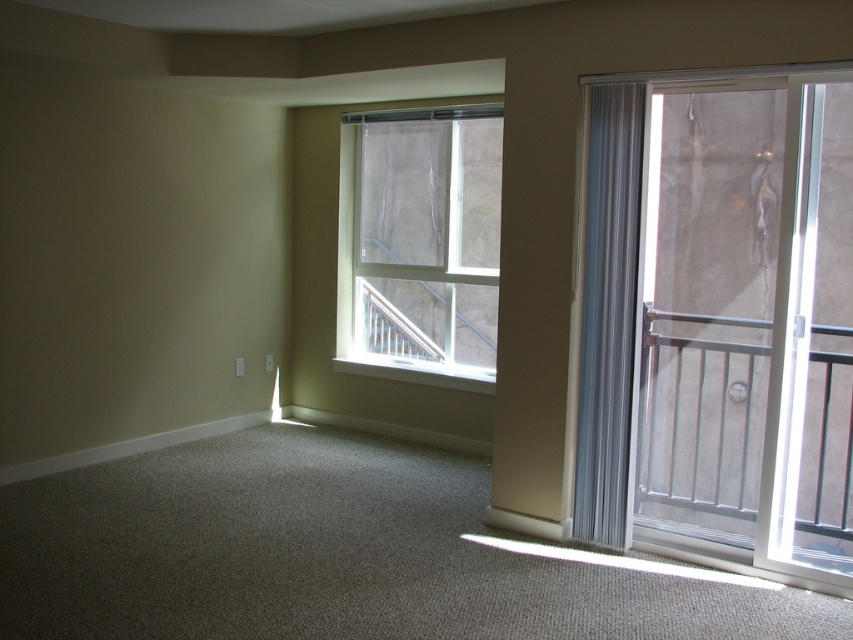
You are planning to move a large potted plant into the room. The plant is too big to fit through the clear glass door at right or the clear glass window at upper center. Which one would you choose to move it through?

The clear glass door at right has a larger size compared to the clear glass window at upper center, so you should choose the clear glass door at right to move the large potted plant through since it is bigger.

You are standing in the living room and want to go outside to the balcony. The clear glass door at right and the clear glass window at upper center are both in front of you. Which one should you go to first to exit?

You should go to the clear glass door at right first because it is positioned on the right side of the clear glass window at upper center, meaning it is closer to your right side and likely the exit.

You are standing in the living room and want to know which of the two points, point [361,248] or point [630,298], is closer to you. Can you determine this based on their positions?

Point [361,248] is further to the camera than point [630,298], so the closer point to you is point [630,298].